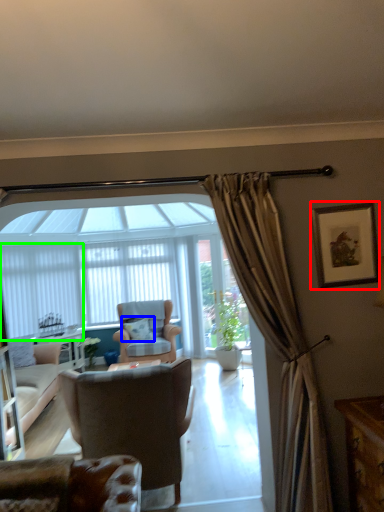
Question: Estimate the real-world distances between objects in this image. Which object is closer to picture frame (highlighted by a red box), pillow (highlighted by a blue box) or curtain (highlighted by a green box)?

Choices:
 (A) pillow
 (B) curtain

Answer: (A)